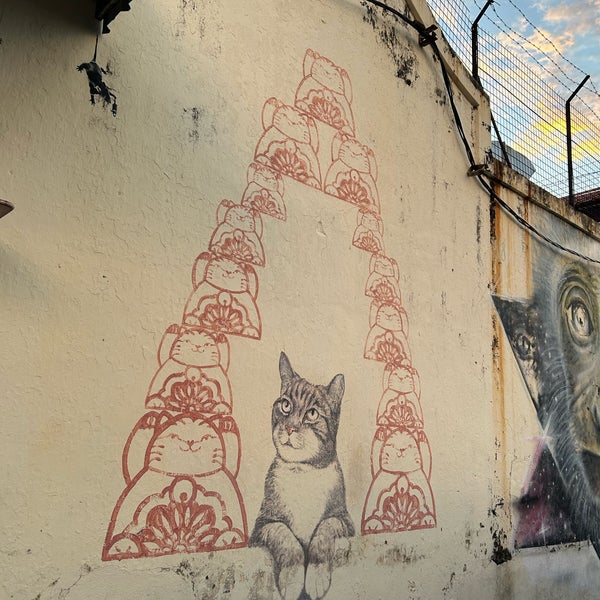
Locate an element on the screen. The image size is (600, 600). yellow wall is located at coordinates (113, 359).